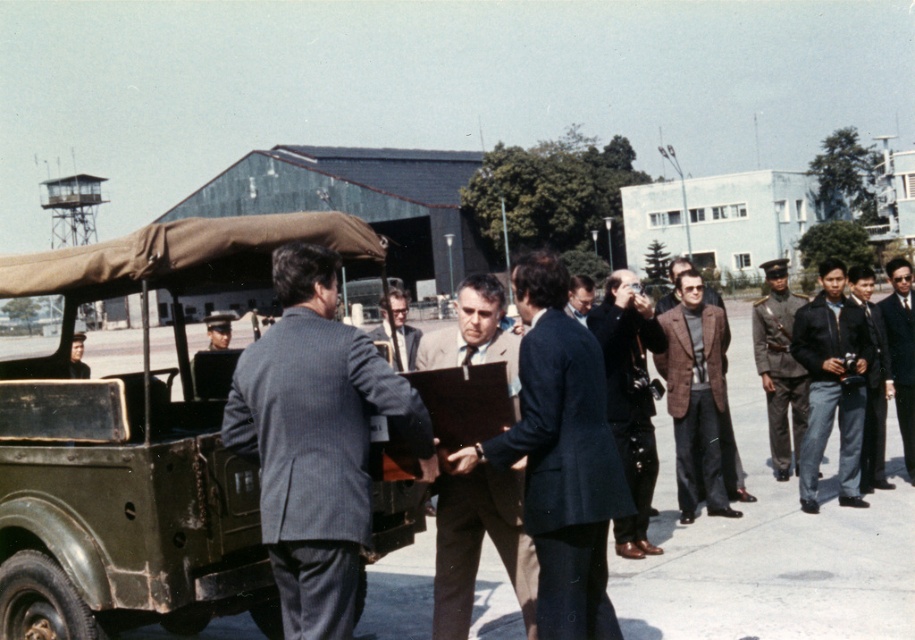
Question: Can you confirm if dark brown uniform at right is thinner than matte gray suit at center?

Choices:
 (A) yes
 (B) no

Answer: (B)

Question: Which of the following is the closest to the observer?

Choices:
 (A) black suit at right
 (B) dark brown uniform at right

Answer: (B)

Question: Is the position of gray pinstripe suit at center more distant than that of black suit at right?

Choices:
 (A) yes
 (B) no

Answer: (B)

Question: Which point is closer to the camera?

Choices:
 (A) (406, 342)
 (B) (533, 349)

Answer: (B)

Question: Can you confirm if gray pinstripe suit at center is bigger than black suit at right?

Choices:
 (A) yes
 (B) no

Answer: (B)

Question: Which object appears closest to the camera in this image?

Choices:
 (A) light brown suit at center
 (B) dark blue suit at right
 (C) matte gray suit at center

Answer: (A)